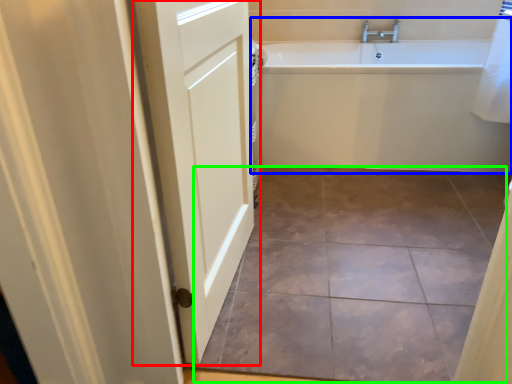
Question: Based on their relative distances, which object is nearer to door (highlighted by a red box)? Choose from bathtub (highlighted by a blue box) and ceramic tile (highlighted by a green box).

Choices:
 (A) bathtub
 (B) ceramic tile

Answer: (B)